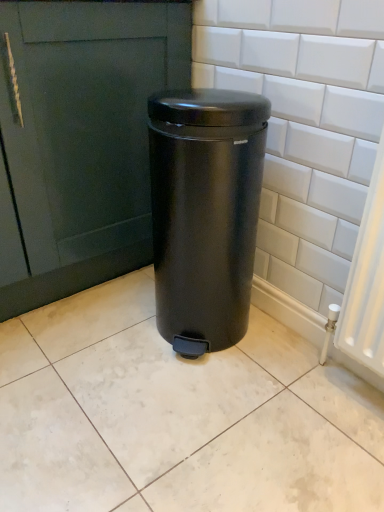
Image resolution: width=384 pixels, height=512 pixels. Identify the location of free spot to the left of matte black trash can at center. (104, 328).